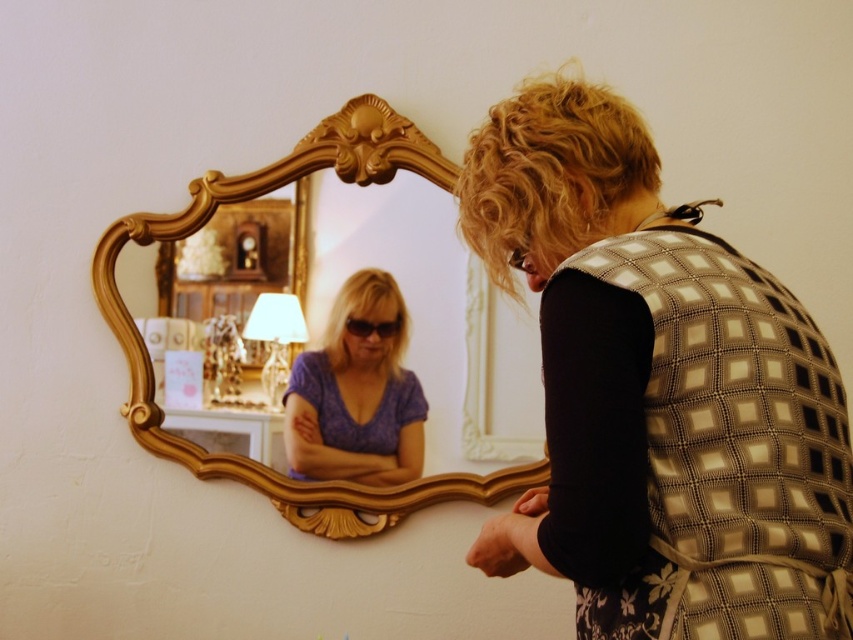
Question: Which point is closer to the camera taking this photo?

Choices:
 (A) (308, 467)
 (B) (276, 474)

Answer: (A)

Question: Which point is farther to the camera?

Choices:
 (A) purple matte shirt at center
 (B) gold ornate mirror at upper center
 (C) patterned fabric vest at center

Answer: (A)

Question: Is patterned fabric vest at center wider than purple matte shirt at center?

Choices:
 (A) yes
 (B) no

Answer: (A)

Question: In this image, where is patterned fabric vest at center located relative to purple matte shirt at center?

Choices:
 (A) left
 (B) right

Answer: (B)

Question: Among these objects, which one is nearest to the camera?

Choices:
 (A) purple matte shirt at center
 (B) patterned fabric vest at center

Answer: (B)

Question: Does patterned fabric vest at center appear over gold ornate mirror at upper center?

Choices:
 (A) yes
 (B) no

Answer: (B)